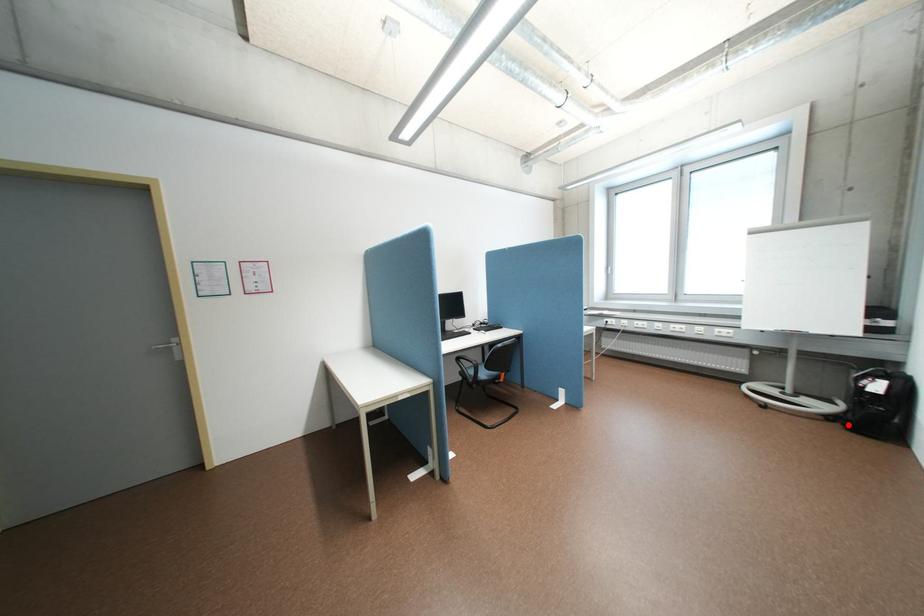
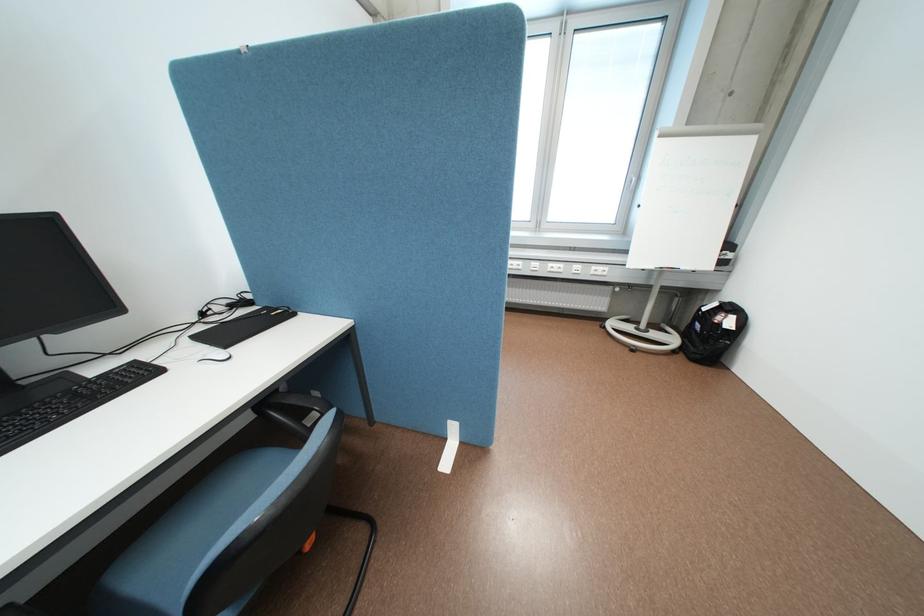
Question: I am providing you with two images of the same scene from different viewpoints. In image1, a red point is highlighted. Considering the same 3D point in image2, which of the following is correct?

Choices:
 (A) It is closer
 (B) It is farther

Answer: (B)